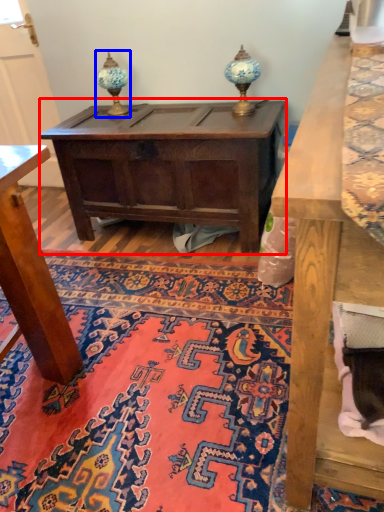
Question: Among these objects, which one is farthest to the camera, table (highlighted by a red box) or table lamp (highlighted by a blue box)?

Choices:
 (A) table
 (B) table lamp

Answer: (B)